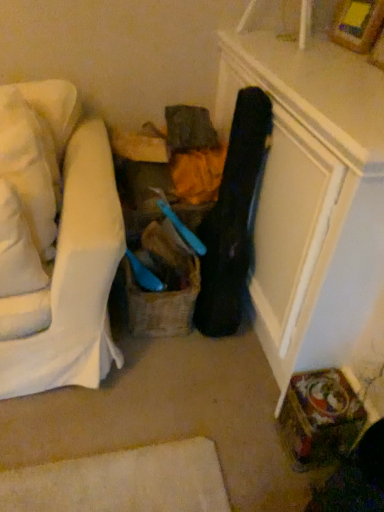
Where is `vacant area that lies in front of black leather guitar case at center`? This screenshot has width=384, height=512. vacant area that lies in front of black leather guitar case at center is located at coordinates (215, 366).